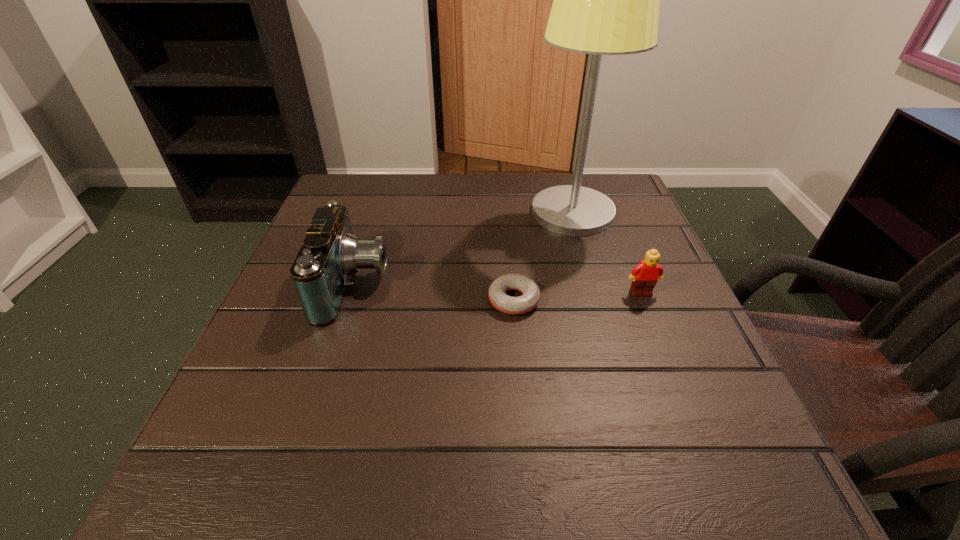
This screenshot has width=960, height=540. In the image, there is a desktop. What are the coordinates of `vacant space at the near left corner` in the screenshot? It's located at (199, 461).

Where is `free space between the third tallest object and the farthest object`? The image size is (960, 540). free space between the third tallest object and the farthest object is located at coordinates (607, 252).

Where is `vacant region between the doughnut and the third tallest object`? Image resolution: width=960 pixels, height=540 pixels. vacant region between the doughnut and the third tallest object is located at coordinates (577, 296).

Where is `vacant area between the Lego and the third object from right to left`? vacant area between the Lego and the third object from right to left is located at coordinates point(577,296).

Where is `vacant space that is in between the farthest object and the leftmost object`? This screenshot has width=960, height=540. vacant space that is in between the farthest object and the leftmost object is located at coordinates (464, 248).

I want to click on unoccupied area between the farthest object and the Lego, so (x=607, y=252).

Where is `free spot between the shortest object and the third tallest object`? The height and width of the screenshot is (540, 960). free spot between the shortest object and the third tallest object is located at coordinates (577, 296).

Where is `blank region between the doughnut and the leftmost object`? blank region between the doughnut and the leftmost object is located at coordinates (434, 293).

Choose which object is the second nearest neighbor to the Lego. Please provide its 2D coordinates. Your answer should be formatted as a tuple, i.e. [(x, y)], where the tuple contains the x and y coordinates of a point satisfying the conditions above.

[(605, 0)]

The height and width of the screenshot is (540, 960). I want to click on object that ranks as the third closest to the Lego, so click(x=330, y=254).